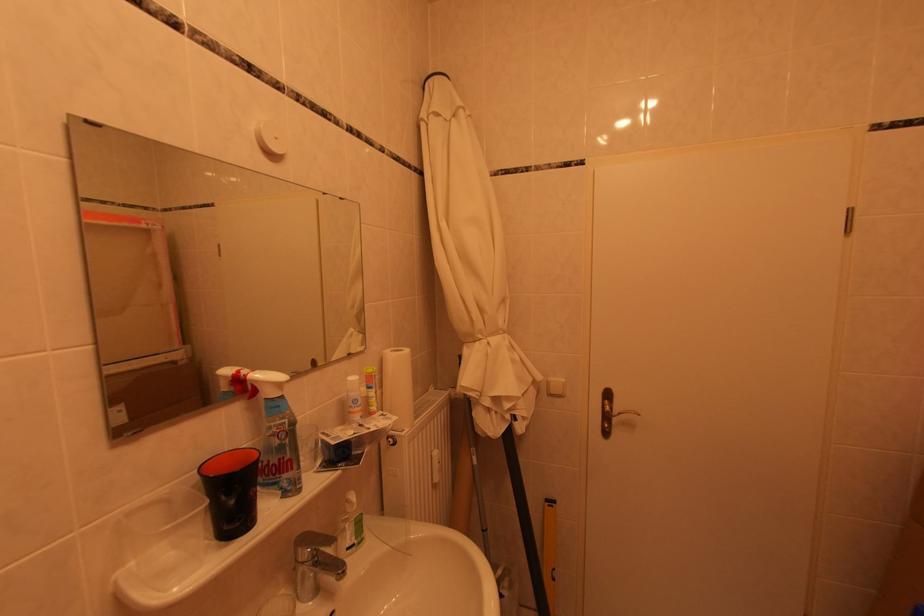
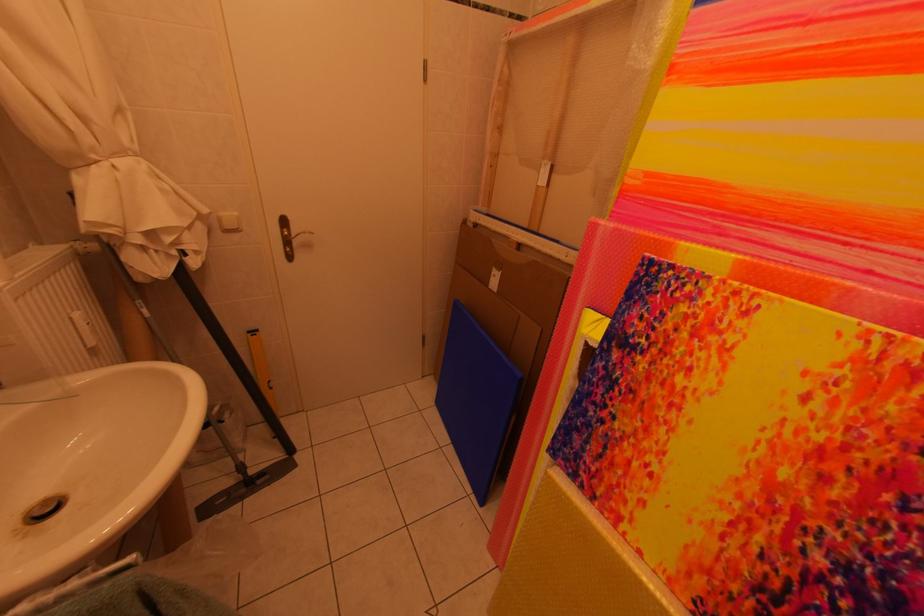
Locate, in the second image, the point that corresponds to pixel 441 459 in the first image.

(79, 321)